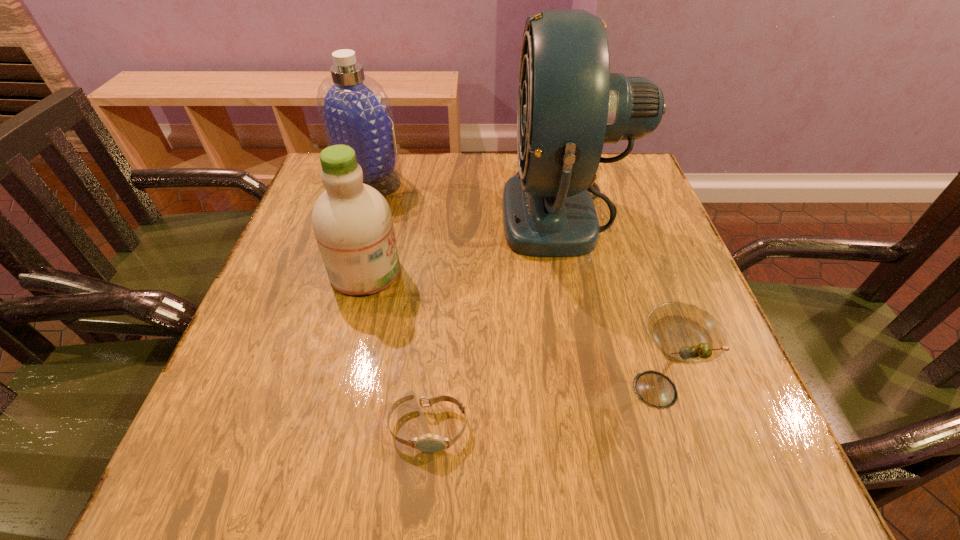
Find the location of `the tallest object`. the tallest object is located at coordinates (569, 105).

Locate an element on the screen. the farther cleansing agent is located at coordinates (354, 109).

You are a GUI agent. You are given a task and a screenshot of the screen. Output one action in this format:
    pyautogui.click(x=<x>, y=<y>)
    Task: Click on the nearer cleansing agent
    The image size is (960, 540).
    Given the screenshot: What is the action you would take?
    pyautogui.click(x=352, y=222)

The width and height of the screenshot is (960, 540). In order to click on martini in this screenshot , I will do `click(683, 333)`.

This screenshot has width=960, height=540. I want to click on watch, so click(431, 443).

You are a GUI agent. You are given a task and a screenshot of the screen. Output one action in this format:
    pyautogui.click(x=<x>, y=<y>)
    Task: Click on the third object from right to left
    
    Given the screenshot: What is the action you would take?
    pyautogui.click(x=431, y=443)

The height and width of the screenshot is (540, 960). Find the location of `free location located in front of the tallest object to blow air`. free location located in front of the tallest object to blow air is located at coordinates (395, 211).

Find the location of a particular element. This screenshot has height=540, width=960. free location located in front of the tallest object to blow air is located at coordinates (444, 211).

The width and height of the screenshot is (960, 540). Find the location of `vacant space situated in front of the tallest object to blow air`. vacant space situated in front of the tallest object to blow air is located at coordinates (378, 211).

Find the location of a particular element. vacant area located on the right of the farther cleansing agent is located at coordinates (469, 178).